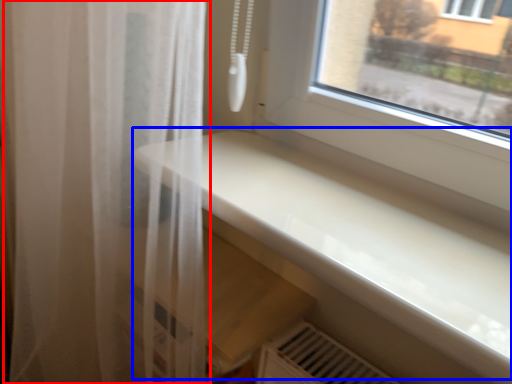
Question: Which of the following is the closest to the observer, curtain (highlighted by a red box) or counter top (highlighted by a blue box)?

Choices:
 (A) curtain
 (B) counter top

Answer: (B)